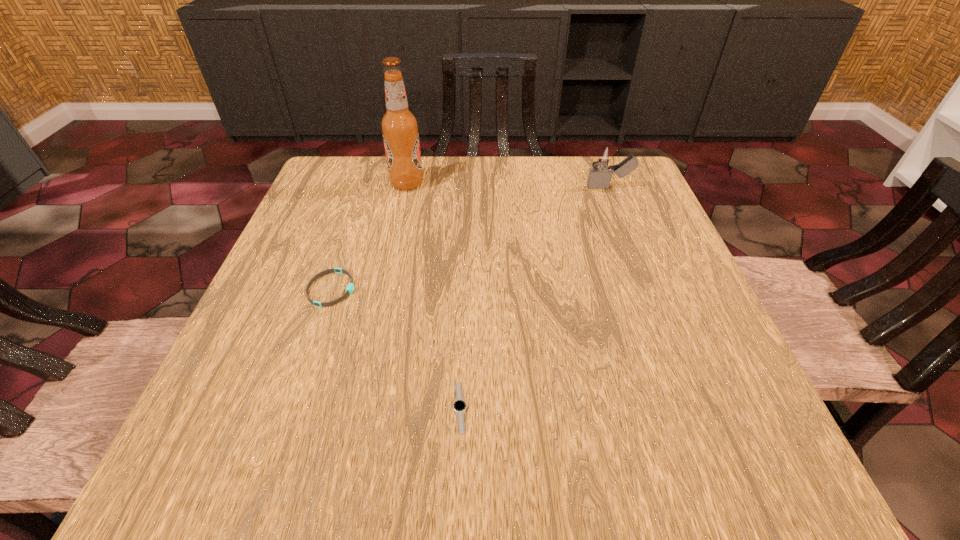
Locate an element on the screen. The height and width of the screenshot is (540, 960). free space located 0.360m on the buckle of the second nearest object is located at coordinates (545, 289).

This screenshot has width=960, height=540. Identify the location of free space located on the left of the watch. (258, 407).

This screenshot has height=540, width=960. I want to click on beer bottle that is at the far edge, so click(399, 126).

Locate an element on the screen. Image resolution: width=960 pixels, height=540 pixels. igniter that is at the far edge is located at coordinates (599, 177).

Where is `object positioned at the near edge`? object positioned at the near edge is located at coordinates (459, 406).

Where is `object located at the left edge`? This screenshot has width=960, height=540. object located at the left edge is located at coordinates (350, 287).

Identify the location of object at the right edge. (599, 177).

Find the location of `object that is positioned at the far right corner`. object that is positioned at the far right corner is located at coordinates (599, 177).

The width and height of the screenshot is (960, 540). Find the location of `vacant space at the near edge`. vacant space at the near edge is located at coordinates (591, 433).

In the image, there is a desktop. At what (x,y) coordinates should I click in order to perform the action: click on vacant space at the left edge. Please return your answer as a coordinate pair (x, y). The image size is (960, 540). Looking at the image, I should click on (277, 396).